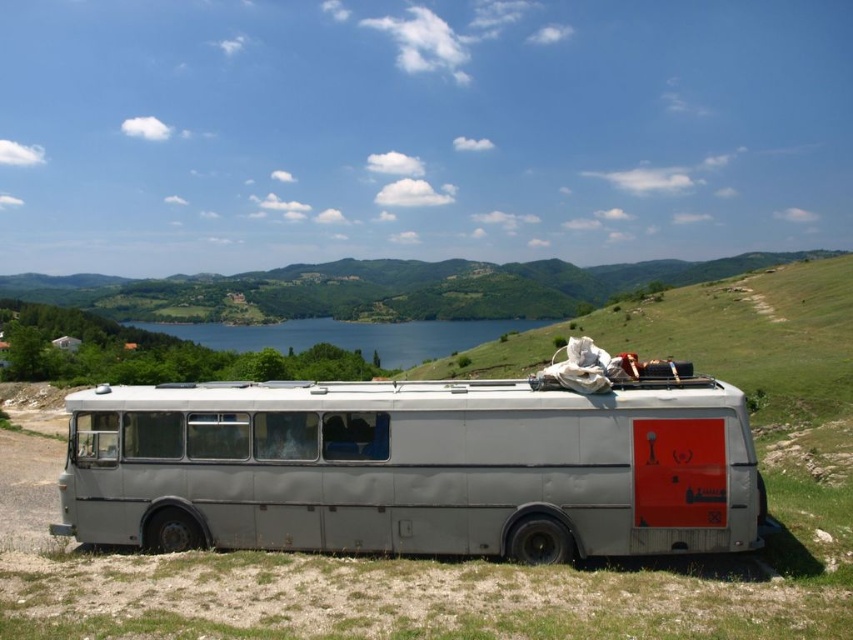
Can you confirm if gray matte van at center is taller than blue water at center?

No.

Between point (633, 474) and point (239, 346), which one is positioned in front?

Point (633, 474)

This screenshot has height=640, width=853. I want to click on gray matte van at center, so click(x=413, y=468).